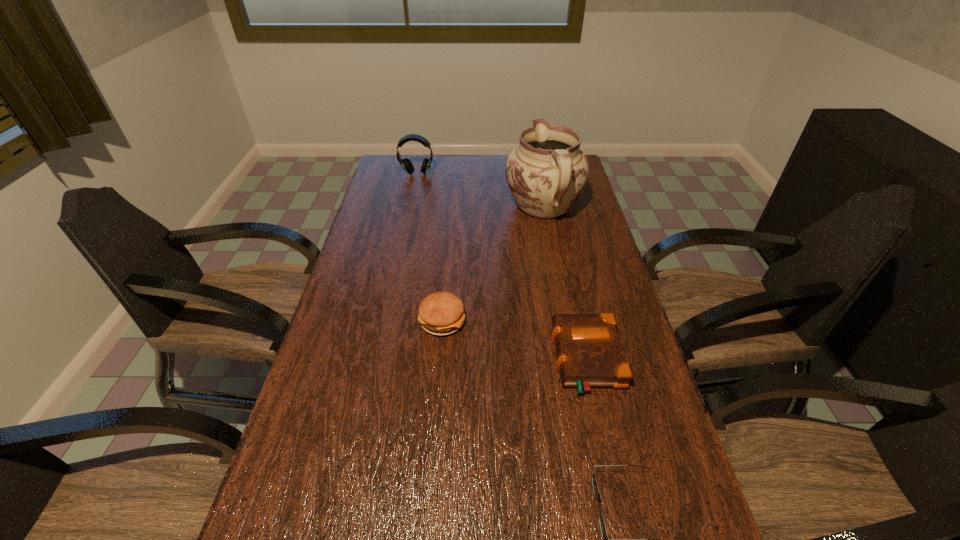
I want to click on free area in between the farthest object and the tallest object, so click(x=480, y=191).

Identify which object is the fourth closest to the leftmost object. Please provide its 2D coordinates. Your answer should be formatted as a tuple, i.e. [(x, y)], where the tuple contains the x and y coordinates of a point satisfying the conditions above.

[(595, 487)]

Where is `object that is the third nearest to the pitcher`? This screenshot has height=540, width=960. object that is the third nearest to the pitcher is located at coordinates (589, 351).

Locate an element on the screen. free spot that satisfies the following two spatial constraints: 1. on the ear cups of the second tallest object; 2. on the left side of the hamburger is located at coordinates (385, 321).